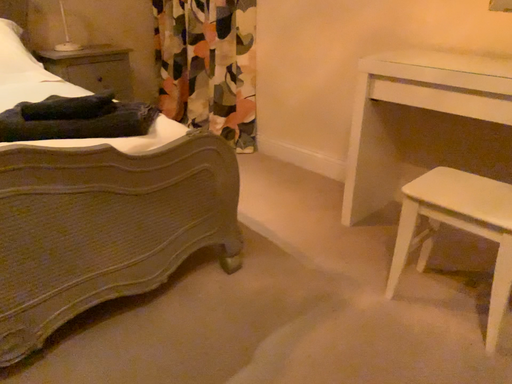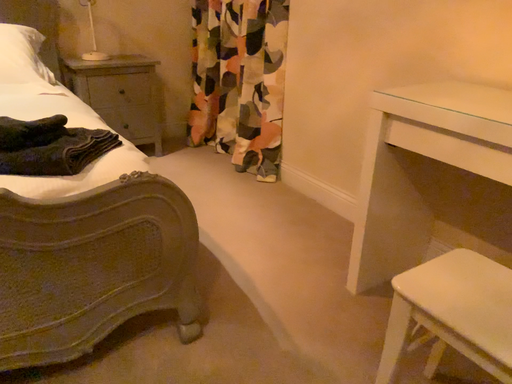
Question: How did the camera likely rotate when shooting the video?

Choices:
 (A) rotated right
 (B) rotated left

Answer: (B)